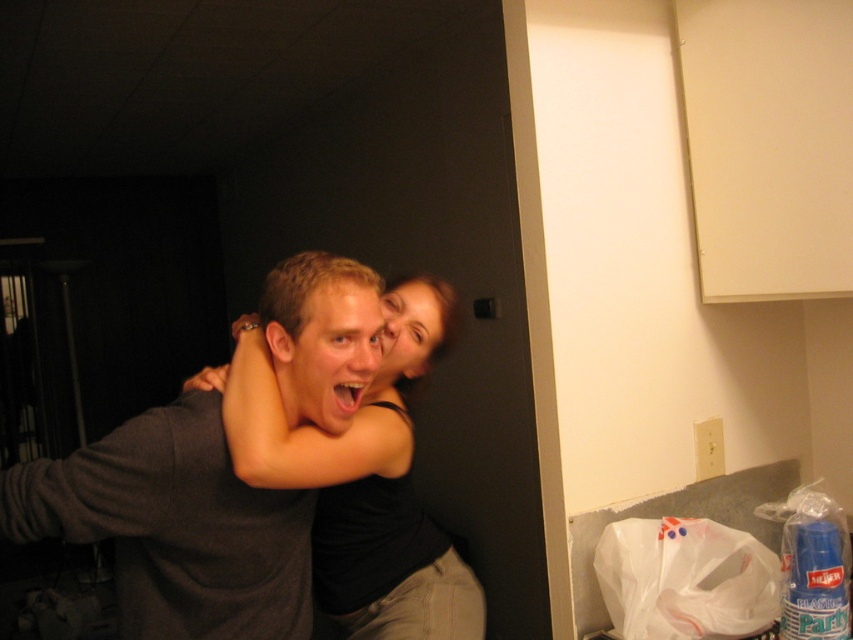
You are standing at the origin point in the image. The dark gray shirt at center is located at coordinates point (175, 528). If you want to move towards the dark gray shirt at center, in which direction should you move?

The dark gray shirt at center is located at point (175, 528), so you should move towards that coordinate to reach it.

You are a photographer trying to capture a group photo of the dark gray shirt at center and the black matte skin at center. If you want to ensure both subjects are fully visible in the frame, which direction should you position the camera relative to their current positions?

Since the dark gray shirt at center is positioned on the left side of black matte skin at center, you should position the camera to the left of the dark gray shirt at center to ensure both subjects are fully visible in the frame.

You are a photographer trying to capture a clear shot of both the dark gray shirt at center and the black matte skin at center. Which object is blocking the other from being fully visible?

The dark gray shirt at center is positioned over black matte skin at center, so it is blocking the black matte skin at center from being fully visible.